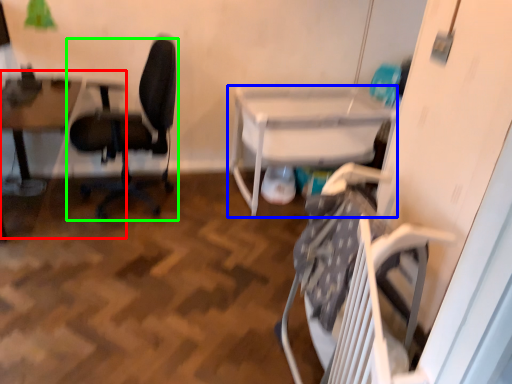
Question: Which object is positioned farthest from table (highlighted by a red box)? Select from table (highlighted by a blue box) and chair (highlighted by a green box).

Choices:
 (A) table
 (B) chair

Answer: (A)